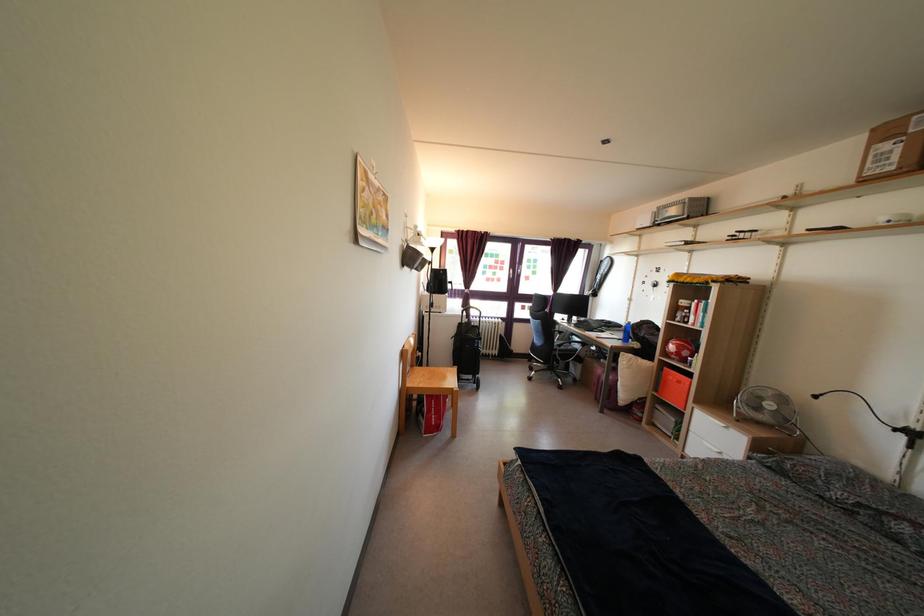
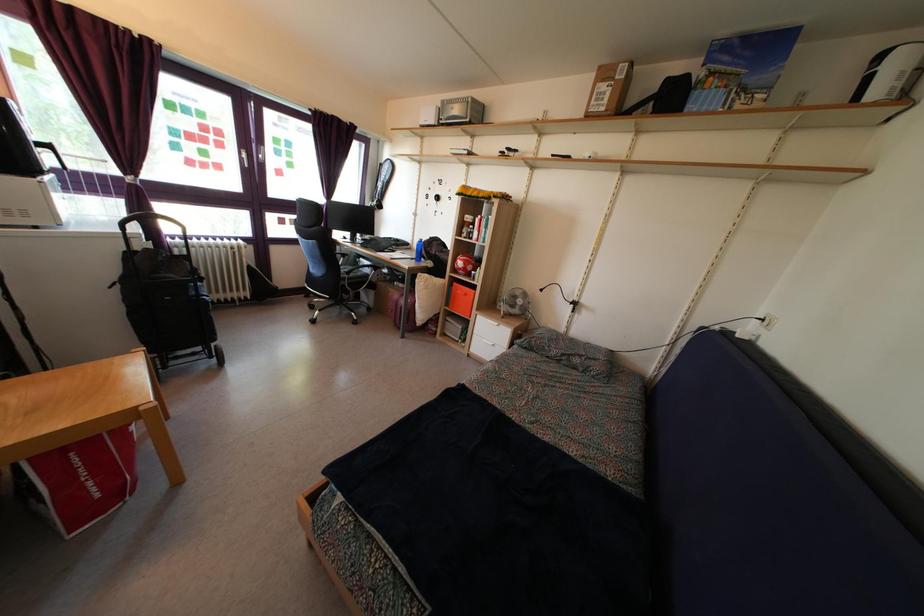
In the second image, find the point that corresponds to point (682, 391) in the first image.

(468, 302)